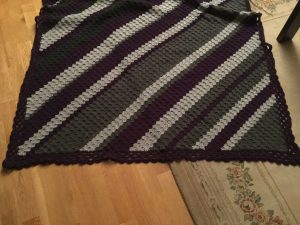
Where is `wood grain`? The width and height of the screenshot is (300, 225). wood grain is located at coordinates (22, 196).